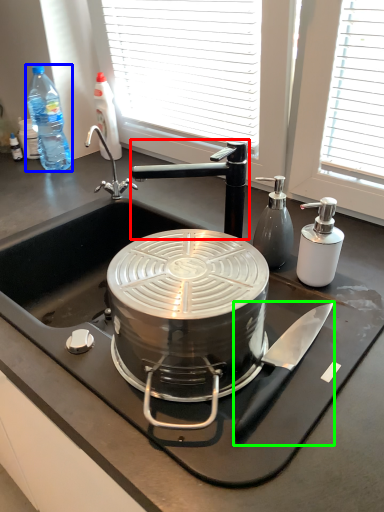
Question: Which object is the closest to the tap (highlighted by a red box)? Choose among these: bottle (highlighted by a blue box) or kitchen appliance (highlighted by a green box).

Choices:
 (A) bottle
 (B) kitchen appliance

Answer: (B)